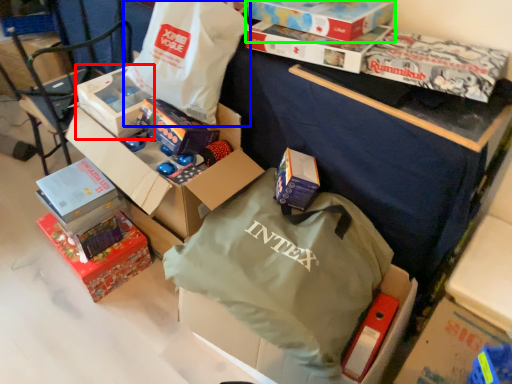
Question: Which object is the farthest from box (highlighted by a red box)? Choose among these: bag (highlighted by a blue box) or box (highlighted by a green box).

Choices:
 (A) bag
 (B) box

Answer: (B)